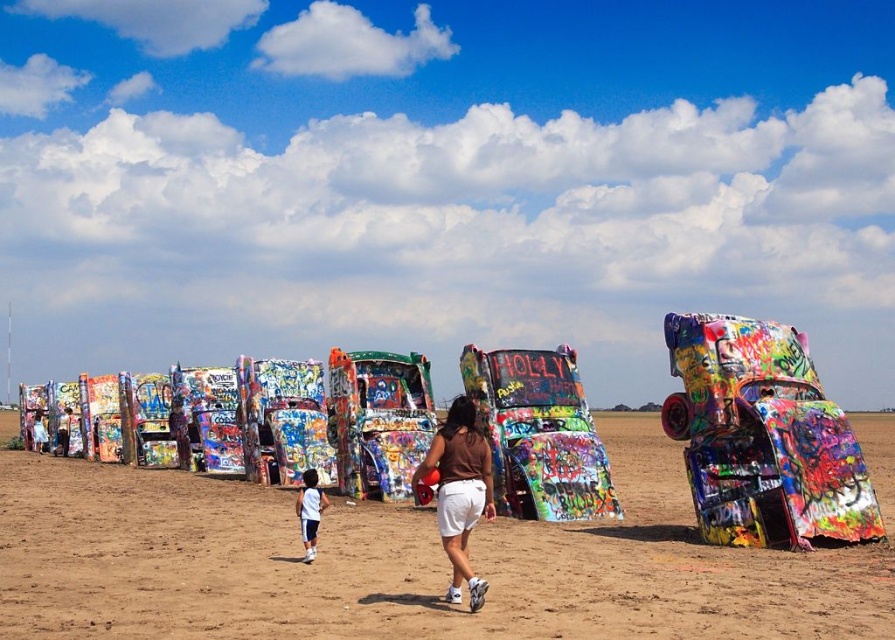
Question: Which of the following is the farthest from the observer?

Choices:
 (A) white cotton shorts at lower center
 (B) brown fabric shorts at center

Answer: (A)

Question: Is the position of brown fabric shorts at center less distant than that of white cotton shorts at lower center?

Choices:
 (A) yes
 (B) no

Answer: (A)

Question: Which of these objects is positioned farthest from the white cotton shorts at lower center?

Choices:
 (A) brown sandy dirt field at center
 (B) brown fabric shorts at center

Answer: (A)

Question: Observing the image, what is the correct spatial positioning of brown fabric shorts at center in reference to white cotton shorts at lower center?

Choices:
 (A) below
 (B) above

Answer: (B)

Question: Which of the following is the farthest from the observer?

Choices:
 (A) (88, 538)
 (B) (478, 508)

Answer: (A)

Question: Is brown fabric shorts at center below white cotton shorts at lower center?

Choices:
 (A) no
 (B) yes

Answer: (A)